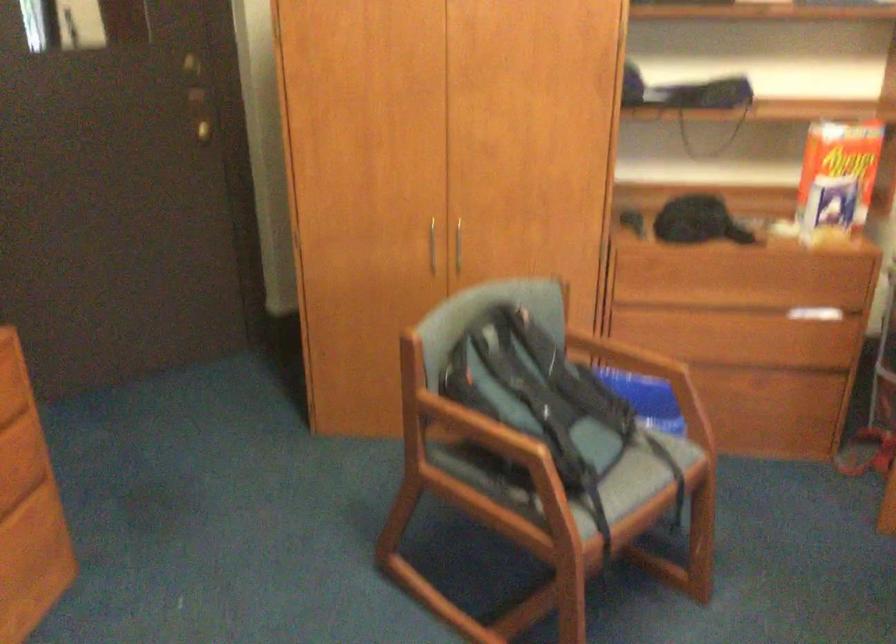
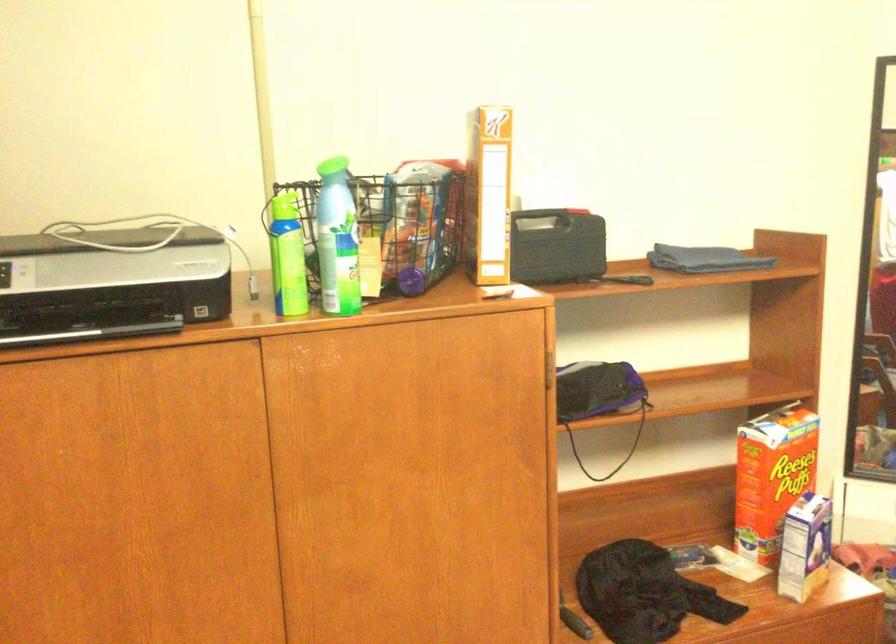
In the second image, find the point that corresponds to (822,202) in the first image.

(805, 547)